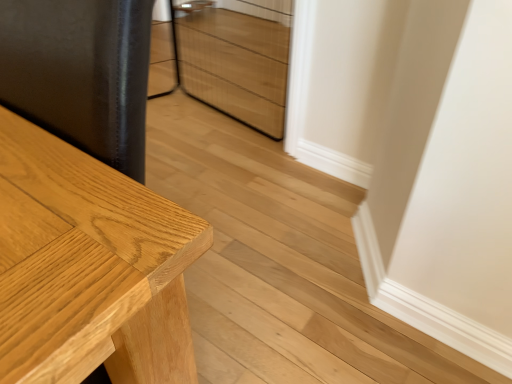
Describe the element at coordinates (92, 269) in the screenshot. I see `light brown wood table at left` at that location.

What is the approximate width of light brown wood table at left?

The width of light brown wood table at left is 13.80 inches.

Measure the distance between point (61, 177) and camera.

Point (61, 177) and camera are 21.73 inches apart from each other.

At what (x,y) coordinates should I click in order to perform the action: click on light brown wood table at left. Please return your answer as a coordinate pair (x, y). Looking at the image, I should click on (92, 269).

Measure the distance between light brown wood table at left and camera.

13.43 inches.

You are a GUI agent. You are given a task and a screenshot of the screen. Output one action in this format:
    pyautogui.click(x=<x>, y=<y>)
    Task: Click on the wooden drawer at center
    The image size is (512, 384).
    Given the screenshot: What is the action you would take?
    pyautogui.click(x=236, y=60)

Describe the element at coordinates (236, 60) in the screenshot. I see `wooden drawer at center` at that location.

The height and width of the screenshot is (384, 512). Find the location of `light brown wood table at left`. light brown wood table at left is located at coordinates (92, 269).

Which object is positioned more to the right, light brown wood table at left or wooden drawer at center?

wooden drawer at center.

Considering their positions, is light brown wood table at left located in front of or behind wooden drawer at center?

light brown wood table at left is in front of wooden drawer at center.

Which point is more forward, (133,197) or (247,118)?

The point (133,197) is closer to the camera.

From the image's perspective, is light brown wood table at left positioned above or below wooden drawer at center?

From the image's perspective, light brown wood table at left appears below wooden drawer at center.

From a real-world perspective, is light brown wood table at left located beneath wooden drawer at center?

Actually, light brown wood table at left is physically above wooden drawer at center in the real world.

Considering the relative sizes of light brown wood table at left and wooden drawer at center in the image provided, is light brown wood table at left wider than wooden drawer at center?

Yes.

Consider the image. Considering the relative sizes of light brown wood table at left and wooden drawer at center in the image provided, is light brown wood table at left taller than wooden drawer at center?

Correct, light brown wood table at left is much taller as wooden drawer at center.

Which of these two, light brown wood table at left or wooden drawer at center, is bigger?

With larger size is light brown wood table at left.

Which is correct: light brown wood table at left is inside wooden drawer at center, or outside of it?

light brown wood table at left is not inside wooden drawer at center, it's outside.

Does light brown wood table at left touch wooden drawer at center?

No, light brown wood table at left is not next to wooden drawer at center.

Is light brown wood table at left oriented away from wooden drawer at center?

No, light brown wood table at left is not facing the opposite direction of wooden drawer at center.

How different are the orientations of light brown wood table at left and wooden drawer at center in degrees?

The facing directions of light brown wood table at left and wooden drawer at center are 5.52 degrees apart.

The width and height of the screenshot is (512, 384). In order to click on drawer above the light brown wood table at left (from the image's perspective) in this screenshot , I will do `click(236, 60)`.

Is wooden drawer at center at the right side of light brown wood table at left?

Yes, wooden drawer at center is to the right of light brown wood table at left.

Is wooden drawer at center closer to camera compared to light brown wood table at left?

That is False.

Is point (248, 110) positioned behind point (147, 341)?

Yes, point (248, 110) is farther from viewer.

From the image's perspective, which one is positioned lower, wooden drawer at center or light brown wood table at left?

light brown wood table at left is shown below in the image.

From a real-world perspective, which object rests below the other?

In real-world perspective, wooden drawer at center is lower.

Is wooden drawer at center wider than light brown wood table at left?

In fact, wooden drawer at center might be narrower than light brown wood table at left.

Considering the sizes of objects wooden drawer at center and light brown wood table at left in the image provided, who is taller, wooden drawer at center or light brown wood table at left?

Standing taller between the two is light brown wood table at left.

Is wooden drawer at center bigger or smaller than light brown wood table at left?

Considering their sizes, wooden drawer at center takes up less space than light brown wood table at left.

Could light brown wood table at left be considered to be inside wooden drawer at center?

No, light brown wood table at left is not inside wooden drawer at center.

Are wooden drawer at center and light brown wood table at left far apart?

That's right, there is a large distance between wooden drawer at center and light brown wood table at left.

Is wooden drawer at center positioned with its back to light brown wood table at left?

No, light brown wood table at left is not at the back of wooden drawer at center.

What's the angular difference between wooden drawer at center and light brown wood table at left's facing directions?

5.52 degrees.

How much distance is there between wooden drawer at center and light brown wood table at left?

wooden drawer at center and light brown wood table at left are 6.31 feet apart.

Image resolution: width=512 pixels, height=384 pixels. I want to click on drawer above the light brown wood table at left (from the image's perspective), so click(x=236, y=60).

There is a wooden drawer at center. Where is `table above it (from a real-world perspective)`? The height and width of the screenshot is (384, 512). table above it (from a real-world perspective) is located at coordinates (92, 269).

The image size is (512, 384). Find the location of `table on the left of wooden drawer at center`. table on the left of wooden drawer at center is located at coordinates (92, 269).